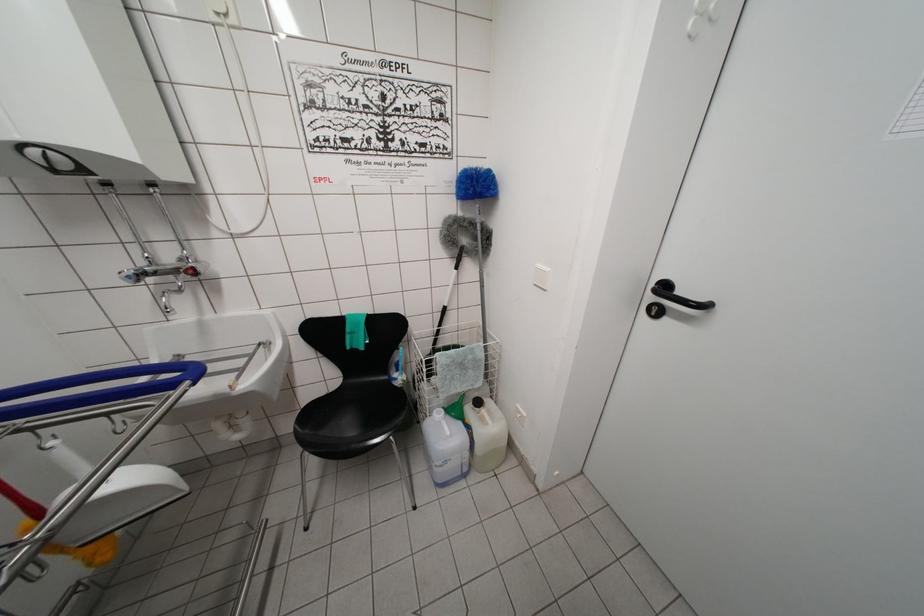
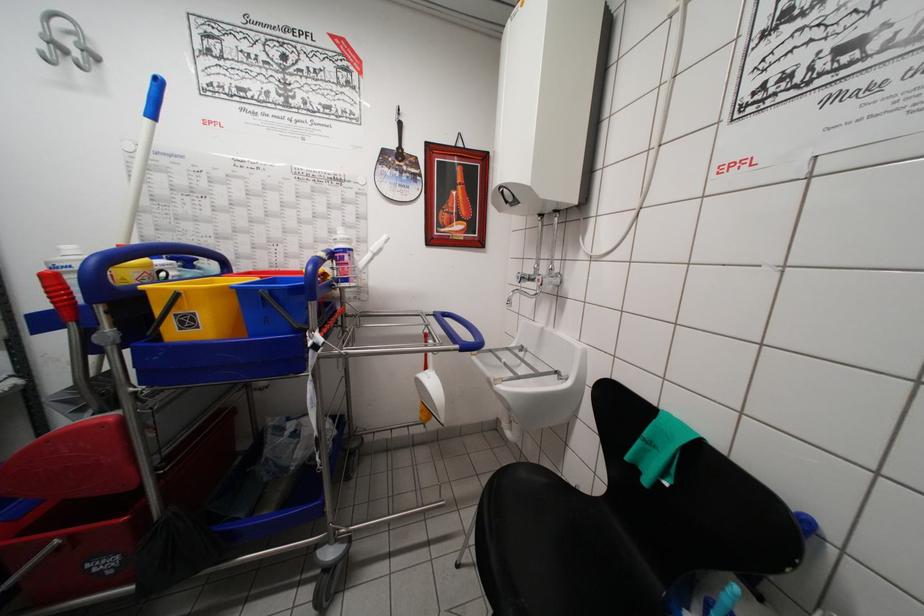
Question: How did the camera likely rotate?

Choices:
 (A) Left
 (B) Right
 (C) Up
 (D) Down

Answer: (A)